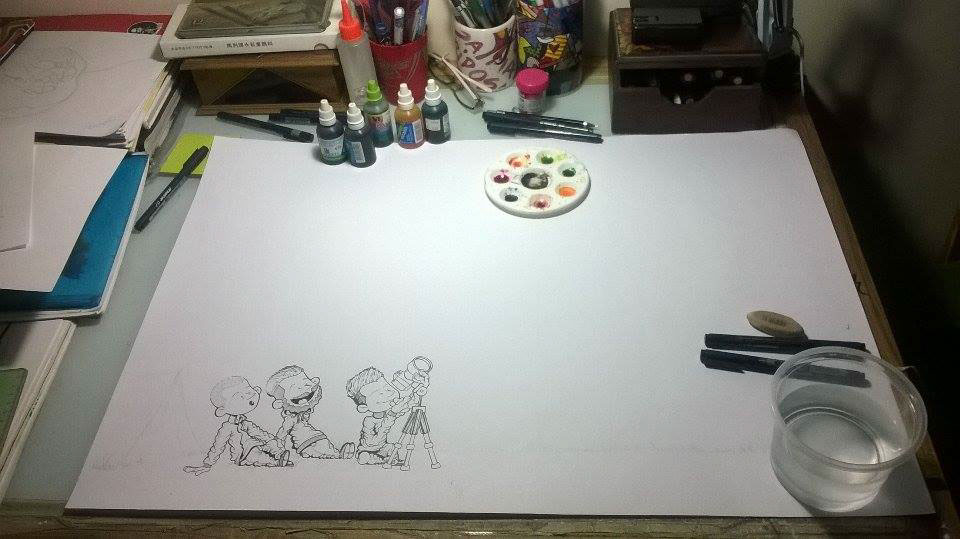
Image resolution: width=960 pixels, height=539 pixels. Identify the location of plastic tub/ container. (877, 391).